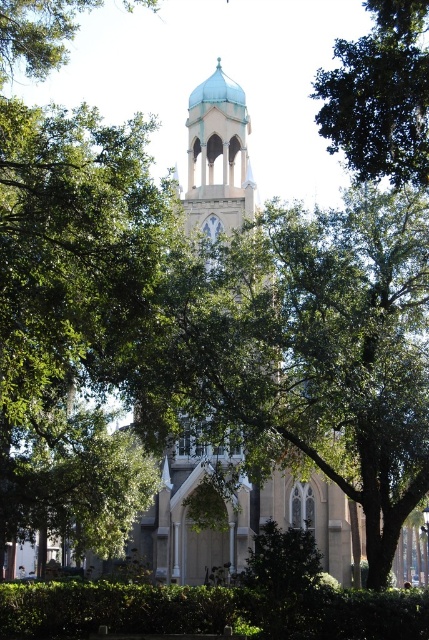
Question: Does green leafy hedge at lower center have a smaller size compared to green leafy tree at upper left?

Choices:
 (A) yes
 (B) no

Answer: (A)

Question: Based on their relative distances, which object is nearer to the light beige stone church at center?

Choices:
 (A) green leafy tree at upper right
 (B) green leafy tree at upper left
 (C) green leafy hedge at lower center

Answer: (C)

Question: Does green leafy tree at upper right appear under green leafy hedge at lower center?

Choices:
 (A) yes
 (B) no

Answer: (B)

Question: Which point is farther to the camera?

Choices:
 (A) green leafy tree at upper right
 (B) green leafy tree at upper left

Answer: (B)

Question: Does light beige stone church at center have a lesser width compared to green leafy tree at upper right?

Choices:
 (A) yes
 (B) no

Answer: (B)

Question: Which object is closer to the camera taking this photo?

Choices:
 (A) green leafy hedge at lower center
 (B) green leafy tree at upper left
 (C) light beige stone church at center
 (D) green leafy tree at upper right

Answer: (D)